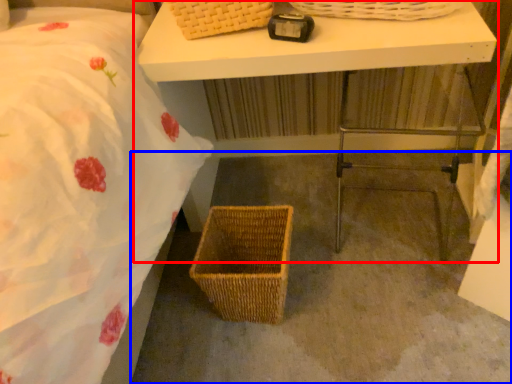
Question: Which object appears farthest to the camera in this image, table (highlighted by a red box) or concrete (highlighted by a blue box)?

Choices:
 (A) table
 (B) concrete

Answer: (B)